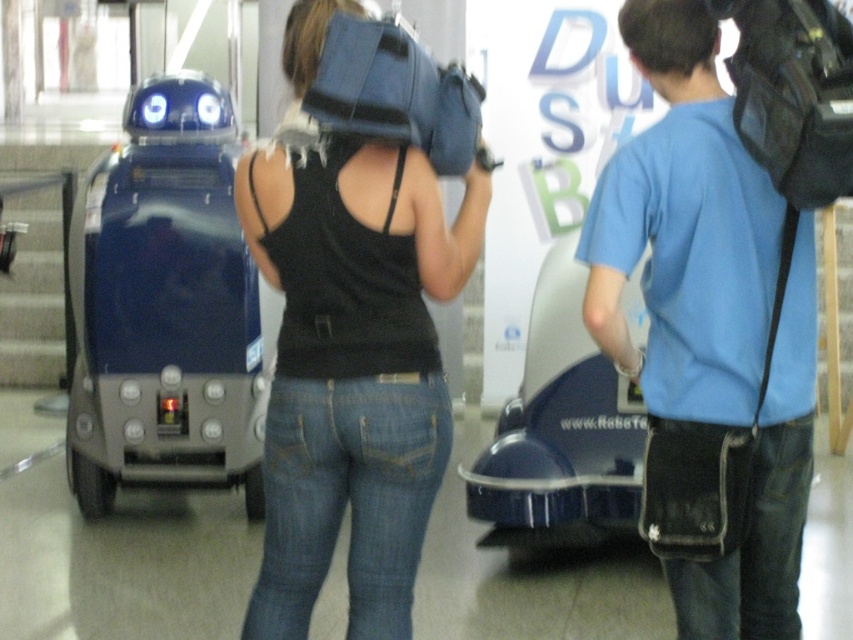
You are a security camera in the mall. You need to locate the black matte tank top at center. What are its coordinates?

The black matte tank top at center is located at coordinates point (352, 371).

You are standing in front of the dark blue robotic vehicle and want to determine which of the two points, point (286,484) or point (717,385), is closer to you. Based on their positions, which point is nearer?

Point (286,484) is closer to you because it is further to the viewer than point (717,385).